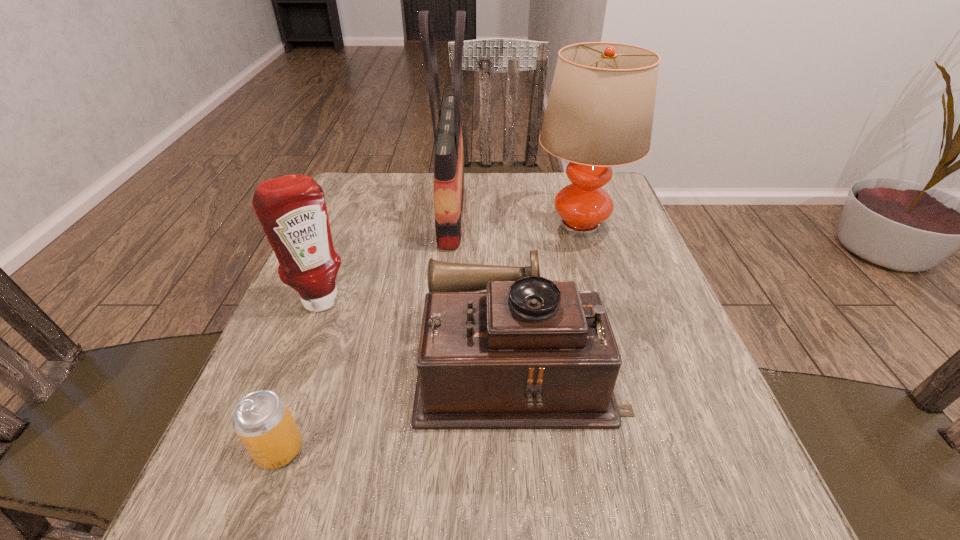
Where is `vacant area located 0.290m on the horn of the phonograph_record`? This screenshot has height=540, width=960. vacant area located 0.290m on the horn of the phonograph_record is located at coordinates (257, 364).

This screenshot has width=960, height=540. What are the coordinates of `vacant space situated on the back of the pop (soda)` in the screenshot? It's located at (333, 300).

Identify the location of shopping bag located in the far edge section of the desktop. (449, 160).

Find the location of a particular element. Image resolution: width=960 pixels, height=540 pixels. lamp located at the far edge is located at coordinates [599, 114].

Where is `condiment that is at the left edge`? condiment that is at the left edge is located at coordinates click(292, 210).

This screenshot has width=960, height=540. Find the location of `pop (soda) at the left edge`. pop (soda) at the left edge is located at coordinates (262, 420).

Where is `lamp positioned at the right edge`? This screenshot has width=960, height=540. lamp positioned at the right edge is located at coordinates (599, 114).

Find the location of a particular element. The height and width of the screenshot is (540, 960). phonograph_record situated at the right edge is located at coordinates (529, 353).

This screenshot has height=540, width=960. I want to click on object that is positioned at the far right corner, so click(x=599, y=114).

Locate an element on the screen. This screenshot has width=960, height=540. blank space at the far edge of the desktop is located at coordinates (401, 192).